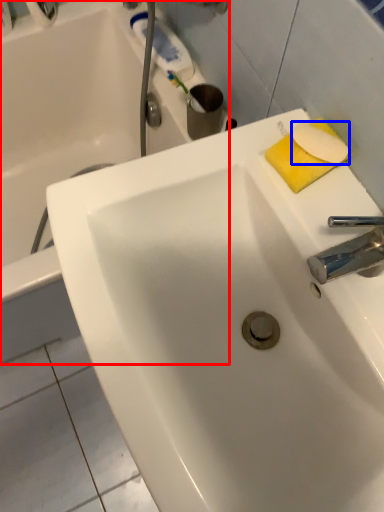
Question: Among these objects, which one is nearest to the camera, bathtub (highlighted by a red box) or soap (highlighted by a blue box)?

Choices:
 (A) bathtub
 (B) soap

Answer: (B)